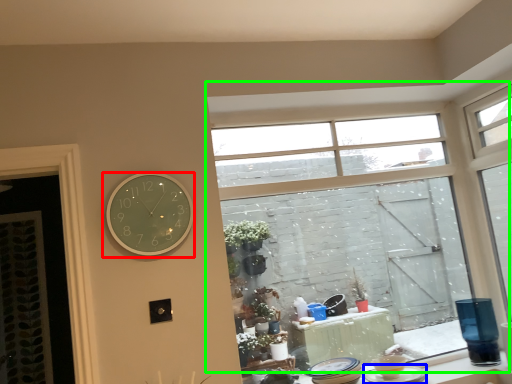
Question: Based on their relative distances, which object is farther from wall clock (highlighted by a red box)? Choose from tableware (highlighted by a blue box) and window (highlighted by a green box).

Choices:
 (A) tableware
 (B) window

Answer: (B)